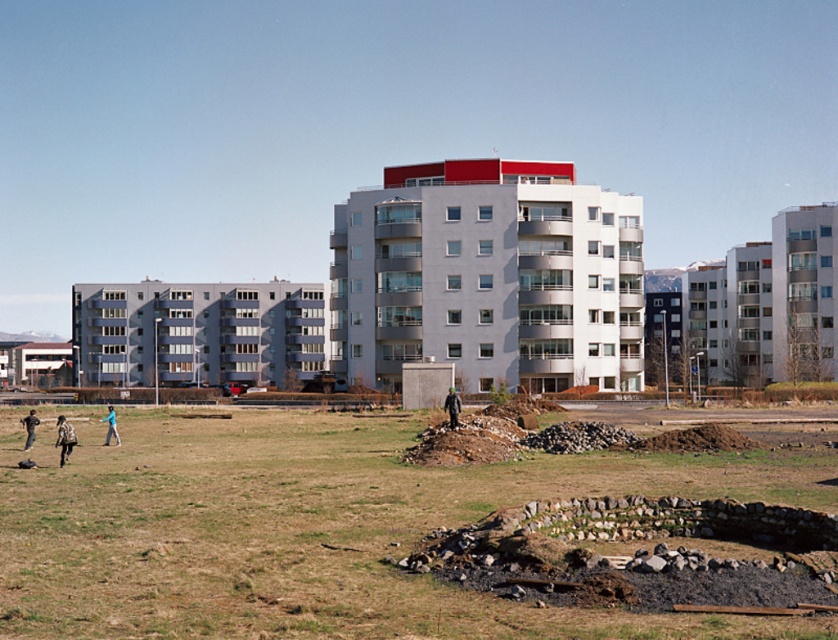
Question: Can you confirm if camouflage-patterned shirt at lower left is positioned to the left of dark gray jacket at lower left?

Choices:
 (A) no
 (B) yes

Answer: (A)

Question: Which of the following is the farthest from the observer?

Choices:
 (A) (75, 442)
 (B) (309, 564)
 (C) (32, 426)
 (D) (115, 429)

Answer: (D)

Question: Which point appears closest to the camera in this image?

Choices:
 (A) (330, 564)
 (B) (34, 433)
 (C) (107, 429)
 (D) (70, 449)

Answer: (A)

Question: Where is brown grass at center located in relation to camouflage-patterned shirt at lower left in the image?

Choices:
 (A) below
 (B) above

Answer: (A)

Question: Can you confirm if brown grass at center is smaller than dark gray jacket at lower left?

Choices:
 (A) no
 (B) yes

Answer: (A)

Question: Which object appears closest to the camera in this image?

Choices:
 (A) camouflage-patterned shirt at lower left
 (B) green fabric jacket at lower left

Answer: (A)